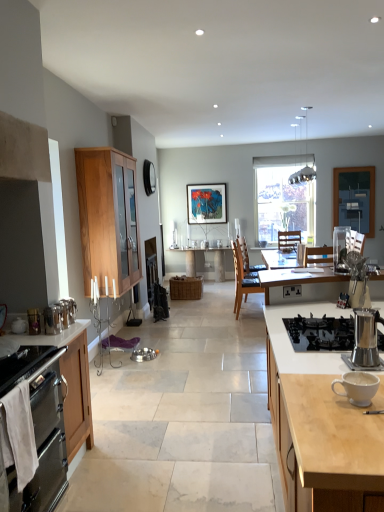
The width and height of the screenshot is (384, 512). Find the location of `clear glass window at center`. clear glass window at center is located at coordinates (283, 198).

What do you see at coordinates (341, 247) in the screenshot? Image resolution: width=384 pixels, height=512 pixels. I see `satin silver coffee maker at center-right, positioned as the 5th appliance in front-to-back order` at bounding box center [341, 247].

What are the coordinates of `polished stainless steel gas stove at right` in the screenshot? It's located at (320, 333).

The height and width of the screenshot is (512, 384). What do you see at coordinates (242, 279) in the screenshot? I see `brown leather chair at center` at bounding box center [242, 279].

I want to click on clear glass window at center, so click(x=283, y=198).

Considering the points (307, 338) and (63, 308), which point is behind, point (307, 338) or point (63, 308)?

The point (63, 308) is more distant.

Considering the relative sizes of polished stainless steel gas stove at right and satin silver coffee pot at left, which is counted as the 3th appliance, starting from the top, in the image provided, is polished stainless steel gas stove at right bigger than satin silver coffee pot at left, which is counted as the 3th appliance, starting from the top,?

Yes.

From a real-world perspective, who is located lower, polished stainless steel gas stove at right or satin silver coffee pot at left, which is counted as the fourth appliance, starting from the front?

In real-world perspective, polished stainless steel gas stove at right is lower.

Is satin silver coffee pot at left, which is counted as the fourth appliance, starting from the front, in contact with light wood/glass cabinet at left, acting as the third cabinetry starting from the front?

No.

Looking at this image, is satin silver coffee pot at left, arranged as the 4th appliance when ordered from the bottom, oriented away from light wood/glass cabinet at left, which ranks as the 1th cabinetry in back-to-front order?

No.

Which is correct: satin silver coffee pot at left, the third appliance in the back-to-front sequence, is inside light wood/glass cabinet at left, the 2th cabinetry in the right-to-left sequence, or outside of it?

satin silver coffee pot at left, the third appliance in the back-to-front sequence, cannot be found inside light wood/glass cabinet at left, the 2th cabinetry in the right-to-left sequence.

Is silver metallic bowls at center, marked as the first appliance in a back-to-front arrangement, spatially inside light wood countertop at right, which is counted as the 1th cabinetry, starting from the right, or outside of it?

silver metallic bowls at center, marked as the first appliance in a back-to-front arrangement, is located beyond the bounds of light wood countertop at right, which is counted as the 1th cabinetry, starting from the right.

Is silver metallic bowls at center, which is the 6th appliance in front-to-back order, taller than light wood countertop at right, which is the first cabinetry from front to back?

No.

Is silver metallic bowls at center, the 6th appliance in the top-to-bottom sequence, far from light wood countertop at right, which is the first cabinetry from front to back?

Indeed, silver metallic bowls at center, the 6th appliance in the top-to-bottom sequence, is not near light wood countertop at right, which is the first cabinetry from front to back.

Is the position of silver metallic bowls at center, placed as the 4th appliance when sorted from left to right, less distant than that of light wood countertop at right, the 3th cabinetry when ordered from back to front?

No, silver metallic bowls at center, placed as the 4th appliance when sorted from left to right, is further to the viewer.

From a real-world perspective, between light wood/glass cabinet at left, acting as the third cabinetry starting from the front, and polished stainless steel gas stove at right, who is vertically higher?

From a 3D spatial view, light wood/glass cabinet at left, acting as the third cabinetry starting from the front, is above.

Is light wood/glass cabinet at left, the 2th cabinetry in the right-to-left sequence, touching polished stainless steel gas stove at right?

There is a gap between light wood/glass cabinet at left, the 2th cabinetry in the right-to-left sequence, and polished stainless steel gas stove at right.

Is point (100, 221) closer or farther from the camera than point (315, 349)?

Point (100, 221) appears to be farther away from the viewer than point (315, 349).

Considering the relative positions of light wood/glass cabinet at left, which ranks as the 1th cabinetry in back-to-front order, and polished stainless steel gas stove at right in the image provided, is light wood/glass cabinet at left, which ranks as the 1th cabinetry in back-to-front order, to the left of polished stainless steel gas stove at right from the viewer's perspective?

Correct, you'll find light wood/glass cabinet at left, which ranks as the 1th cabinetry in back-to-front order, to the left of polished stainless steel gas stove at right.

Is point (247, 279) farther from camera compared to point (344, 258)?

Yes, point (247, 279) is farther from viewer.

Is brown leather chair at center beside satin silver coffee maker at center-right, placed as the 6th appliance when sorted from bottom to top?

brown leather chair at center is not next to satin silver coffee maker at center-right, placed as the 6th appliance when sorted from bottom to top, and they're not touching.

Does brown leather chair at center have a smaller size compared to satin silver coffee maker at center-right, the first appliance from the top?

Actually, brown leather chair at center might be larger than satin silver coffee maker at center-right, the first appliance from the top.

How many degrees apart are the facing directions of stainless steel espresso maker at right, arranged as the 6th appliance when viewed from the back, and metallic silver kettle at left, which appears as the sixth appliance when viewed from the right?

177 degrees separate the facing orientations of stainless steel espresso maker at right, arranged as the 6th appliance when viewed from the back, and metallic silver kettle at left, which appears as the sixth appliance when viewed from the right.

Is there a large distance between stainless steel espresso maker at right, arranged as the 1th appliance when viewed from the front, and metallic silver kettle at left, acting as the 4th appliance starting from the back?

Yes, stainless steel espresso maker at right, arranged as the 1th appliance when viewed from the front, and metallic silver kettle at left, acting as the 4th appliance starting from the back, are quite far apart.

Which object is positioned more to the right, stainless steel espresso maker at right, acting as the 5th appliance starting from the left, or metallic silver kettle at left, which appears as the sixth appliance when viewed from the right?

From the viewer's perspective, stainless steel espresso maker at right, acting as the 5th appliance starting from the left, appears more on the right side.

Could you tell me if stainless steel espresso maker at right, which ranks as the 2th appliance in right-to-left order, is turned towards metallic silver kettle at left, which appears as the sixth appliance when viewed from the right?

No, stainless steel espresso maker at right, which ranks as the 2th appliance in right-to-left order, is not facing towards metallic silver kettle at left, which appears as the sixth appliance when viewed from the right.

Based on the photo, from the image's perspective, is satin silver coffee pot at left, which is counted as the fourth appliance, starting from the front, located beneath clear glass window at center?

Yes, from the image's perspective, satin silver coffee pot at left, which is counted as the fourth appliance, starting from the front, is beneath clear glass window at center.

Is satin silver coffee pot at left, which is counted as the fourth appliance, starting from the front, closer to camera compared to clear glass window at center?

Yes, it is in front of clear glass window at center.

Can you see satin silver coffee pot at left, the third appliance in the left-to-right sequence, touching clear glass window at center?

No, satin silver coffee pot at left, the third appliance in the left-to-right sequence, is not with clear glass window at center.

Starting from the polished stainless steel gas stove at right, which appliance is the 3rd one behind? Please provide its 2D coordinates.

[(64, 312)]

Identify the location of cabinetry positioned vertically above the satin silver coffee pot at left, the third appliance in the left-to-right sequence (from a real-world perspective). (108, 217).

Looking at the image, which one is located further to stainless steel oven at lower left, metallic silver kettle at left, the 1th appliance viewed from the left, or light wood/glass cabinet at left, which ranks as the 1th cabinetry in back-to-front order?

light wood/glass cabinet at left, which ranks as the 1th cabinetry in back-to-front order, is positioned further to the anchor stainless steel oven at lower left.

When comparing their distances from satin silver coffee pot at left, arranged as the 4th appliance when ordered from the bottom, does brown leather chair at center or white glossy countertop at lower left seem further?

Answer: Based on the image, brown leather chair at center appears to be further to satin silver coffee pot at left, arranged as the 4th appliance when ordered from the bottom.

Based on the photo, based on their spatial positions, is stainless steel espresso maker at right, acting as the 5th appliance starting from the left, or silver metallic bowls at center, the first appliance positioned from the bottom, further from metallic silver canister at left, acting as the 3th appliance starting from the bottom?

silver metallic bowls at center, the first appliance positioned from the bottom, is further to metallic silver canister at left, acting as the 3th appliance starting from the bottom.

When comparing their distances from metallic silver kettle at left, the 1th appliance viewed from the left, does satin silver coffee pot at left, arranged as the 4th appliance when ordered from the bottom, or polished stainless steel gas stove at right seem closer?

Based on the image, satin silver coffee pot at left, arranged as the 4th appliance when ordered from the bottom, appears to be nearer to metallic silver kettle at left, the 1th appliance viewed from the left.

When comparing their distances from metallic silver canister at left, acting as the 3th appliance starting from the bottom, does wooden table at center or clear glass window at center seem closer?

Among the two, wooden table at center is located nearer to metallic silver canister at left, acting as the 3th appliance starting from the bottom.

When comparing their distances from white glossy countertop at lower left, does matte wooden picture frame at center or brown leather chair at center seem further?

matte wooden picture frame at center lies further to white glossy countertop at lower left than the other object.

From the picture: Considering their positions, is metallic silver kettle at left, placed as the fifth appliance when sorted from top to bottom, positioned closer to stainless steel espresso maker at right, which ranks as the 2th appliance in right-to-left order, than metallic silver canister at left, which appears as the 5th appliance when viewed from the back?

metallic silver canister at left, which appears as the 5th appliance when viewed from the back, is positioned closer to the anchor stainless steel espresso maker at right, which ranks as the 2th appliance in right-to-left order.

Considering their positions, is silver metallic bowls at center, marked as the first appliance in a back-to-front arrangement, positioned closer to satin silver coffee pot at left, arranged as the 4th appliance when ordered from the bottom, than light wood countertop at right, which is counted as the 1th cabinetry, starting from the right?

Based on the image, light wood countertop at right, which is counted as the 1th cabinetry, starting from the right, appears to be nearer to satin silver coffee pot at left, arranged as the 4th appliance when ordered from the bottom.

The height and width of the screenshot is (512, 384). What are the coordinates of `kitchen appliance between light wood countertop at right, which is the first cabinetry from front to back, and light wood/glass cabinet at left, the 2th cabinetry in the right-to-left sequence, in the front-back direction` in the screenshot? It's located at (40, 426).

I want to click on coffee cup between white glossy countertop at lower left and stainless steel espresso maker at right, arranged as the 6th appliance when viewed from the back, in the horizontal direction, so click(358, 387).

Find the location of a particular element. chair between metallic silver canister at left, arranged as the fourth appliance when viewed from the top, and matte wooden picture frame at center from front to back is located at coordinates (242, 279).

Identify the location of kitchen appliance located between metallic silver kettle at left, the 1th appliance viewed from the left, and stainless steel espresso maker at right, the 5th appliance from the bottom, in the left-right direction. This screenshot has height=512, width=384. (40, 426).